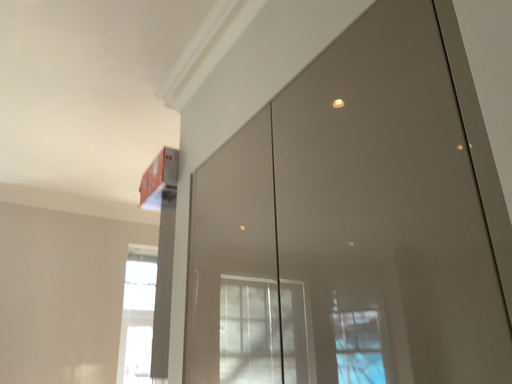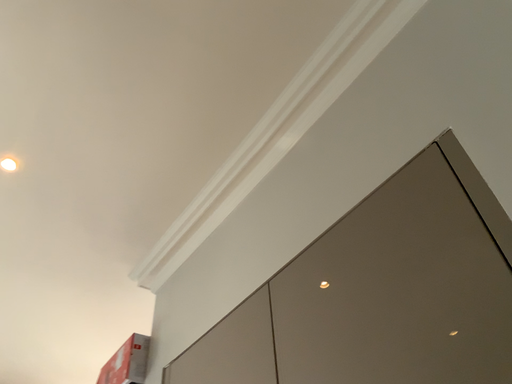
Question: How did the camera likely rotate when shooting the video?

Choices:
 (A) rotated downward
 (B) rotated upward

Answer: (B)